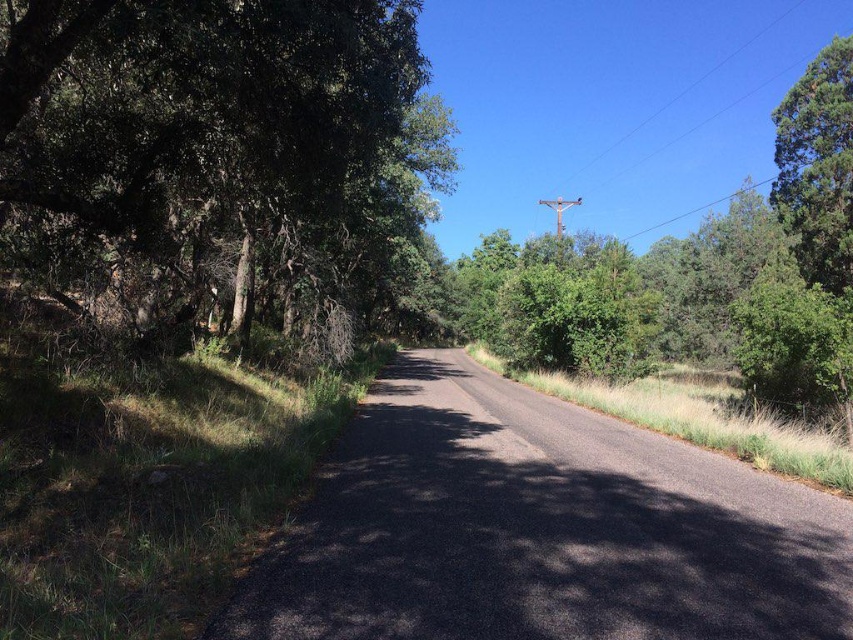
Does black asphalt road at center have a greater height compared to metallic gray telegraph pole at center?

No.

Between black asphalt road at center and metallic gray telegraph pole at center, which one appears on the right side from the viewer's perspective?

metallic gray telegraph pole at center

You are a GUI agent. You are given a task and a screenshot of the screen. Output one action in this format:
    pyautogui.click(x=<x>, y=<y>)
    Task: Click on the black asphalt road at center
    
    Given the screenshot: What is the action you would take?
    pyautogui.click(x=538, y=529)

Which of these two, green textured tree at right or metallic gray telegraph pole at center, stands taller?

green textured tree at right

Can you confirm if green textured tree at right is positioned below metallic gray telegraph pole at center?

No.

Where is `green textured tree at right`? This screenshot has height=640, width=853. green textured tree at right is located at coordinates (817, 166).

Is green textured tree at right below metallic wire at upper center?

Indeed, green textured tree at right is positioned under metallic wire at upper center.

At what (x,y) coordinates should I click in order to perform the action: click on green textured tree at right. Please return your answer as a coordinate pair (x, y). The image size is (853, 640). Looking at the image, I should click on [x=817, y=166].